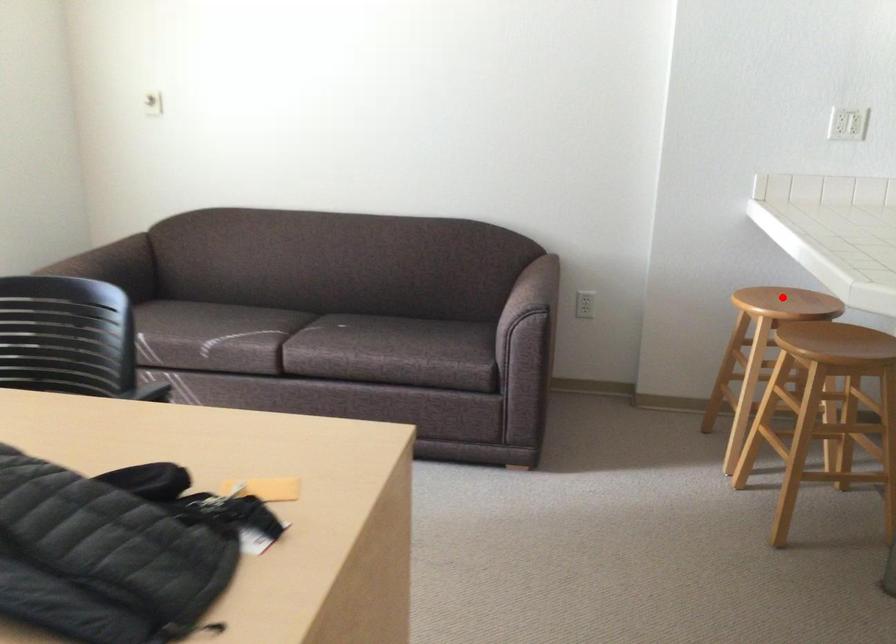
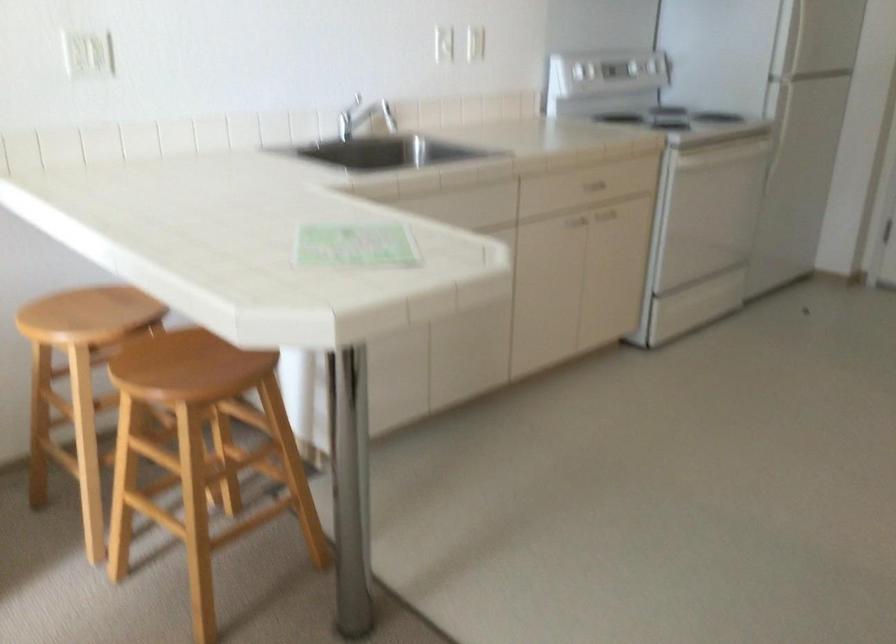
In the second image, find the point that corresponds to the highlighted location in the first image.

(82, 315)